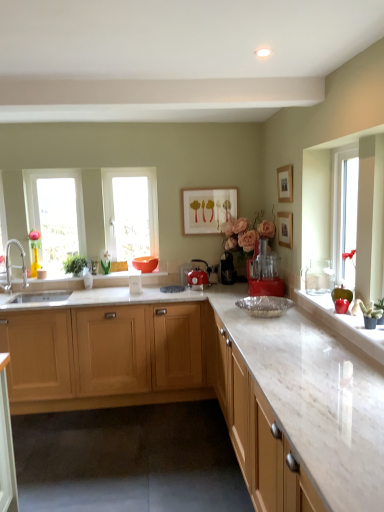
Question: Are green matte cactus at right, arranged as the first plant when viewed from the front, and wooden picture frame at upper right, which is counted as the 2th picture frame, starting from the back, far apart?

Choices:
 (A) no
 (B) yes

Answer: (A)

Question: Does green matte cactus at right, which is the 1th plant in bottom-to-top order, lie behind wooden picture frame at upper right, which is the 1th picture frame in right-to-left order?

Choices:
 (A) no
 (B) yes

Answer: (A)

Question: Considering the relative sizes of green matte cactus at right, arranged as the first plant when viewed from the front, and wooden picture frame at upper right, the second picture frame when ordered from front to back, in the image provided, is green matte cactus at right, arranged as the first plant when viewed from the front, thinner than wooden picture frame at upper right, the second picture frame when ordered from front to back,?

Choices:
 (A) yes
 (B) no

Answer: (B)

Question: Is green matte cactus at right, which is the 1th plant in bottom-to-top order, taller than wooden picture frame at upper right, the second picture frame when ordered from front to back?

Choices:
 (A) yes
 (B) no

Answer: (B)

Question: From the image's perspective, does green matte cactus at right, arranged as the first plant when viewed from the front, appear higher than wooden picture frame at upper right, which is the 1th picture frame in right-to-left order?

Choices:
 (A) yes
 (B) no

Answer: (B)

Question: Considering the relative sizes of green matte cactus at right, acting as the second plant starting from the left, and wooden picture frame at upper right, which appears as the 3th picture frame when viewed from the left, in the image provided, is green matte cactus at right, acting as the second plant starting from the left, bigger than wooden picture frame at upper right, which appears as the 3th picture frame when viewed from the left,?

Choices:
 (A) yes
 (B) no

Answer: (B)

Question: Does matte orange bowl at center turn towards transparent glass window at left, positioned as the second window in right-to-left order?

Choices:
 (A) yes
 (B) no

Answer: (B)

Question: Can you confirm if matte orange bowl at center is positioned to the right of transparent glass window at left, positioned as the second window in right-to-left order?

Choices:
 (A) yes
 (B) no

Answer: (A)

Question: From a real-world perspective, is matte orange bowl at center physically above transparent glass window at left, the first window when ordered from left to right?

Choices:
 (A) yes
 (B) no

Answer: (B)

Question: Is matte orange bowl at center not inside transparent glass window at left, the first window when ordered from left to right?

Choices:
 (A) no
 (B) yes

Answer: (B)

Question: Can you confirm if matte orange bowl at center is thinner than transparent glass window at left, the first window when ordered from left to right?

Choices:
 (A) yes
 (B) no

Answer: (B)

Question: Is matte orange bowl at center closer to the viewer compared to transparent glass window at left, positioned as the second window in right-to-left order?

Choices:
 (A) no
 (B) yes

Answer: (A)

Question: Is matte wooden picture frame at center, which appears as the first picture frame when viewed from the back, in contact with transparent glass window at center, placed as the 1th window when sorted from right to left?

Choices:
 (A) yes
 (B) no

Answer: (B)